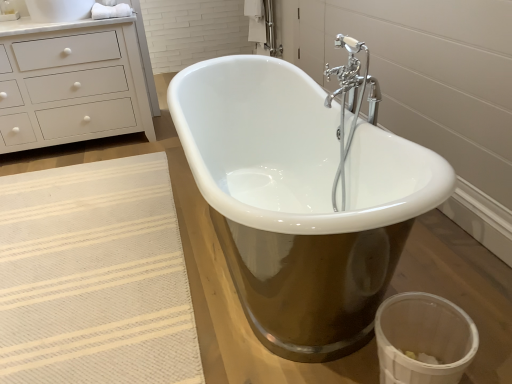
Question: Is transparent plastic toilet bowl at lower right bigger than white cotton towel at upper left?

Choices:
 (A) yes
 (B) no

Answer: (A)

Question: Does transparent plastic toilet bowl at lower right lie in front of white cotton towel at upper left?

Choices:
 (A) yes
 (B) no

Answer: (A)

Question: Is white cotton towel at upper left at the back of transparent plastic toilet bowl at lower right?

Choices:
 (A) yes
 (B) no

Answer: (B)

Question: Considering the relative sizes of transparent plastic toilet bowl at lower right and white cotton towel at upper left in the image provided, is transparent plastic toilet bowl at lower right thinner than white cotton towel at upper left?

Choices:
 (A) yes
 (B) no

Answer: (B)

Question: Would you say transparent plastic toilet bowl at lower right contains white cotton towel at upper left?

Choices:
 (A) yes
 (B) no

Answer: (B)

Question: Is transparent plastic toilet bowl at lower right wider than white cotton towel at upper left?

Choices:
 (A) yes
 (B) no

Answer: (A)

Question: From a real-world perspective, does white matte chest of drawers at upper left sit lower than beige woven rug at lower left?

Choices:
 (A) yes
 (B) no

Answer: (B)

Question: Could beige woven rug at lower left be considered to be inside white matte chest of drawers at upper left?

Choices:
 (A) no
 (B) yes

Answer: (A)

Question: Is white matte chest of drawers at upper left shorter than beige woven rug at lower left?

Choices:
 (A) yes
 (B) no

Answer: (B)

Question: From the image's perspective, is white matte chest of drawers at upper left above beige woven rug at lower left?

Choices:
 (A) yes
 (B) no

Answer: (A)

Question: Is white matte chest of drawers at upper left facing towards beige woven rug at lower left?

Choices:
 (A) no
 (B) yes

Answer: (B)

Question: Does white matte chest of drawers at upper left come behind beige woven rug at lower left?

Choices:
 (A) yes
 (B) no

Answer: (A)

Question: Is white cotton towel at upper left to the right of white matte chest of drawers at upper left from the viewer's perspective?

Choices:
 (A) yes
 (B) no

Answer: (A)